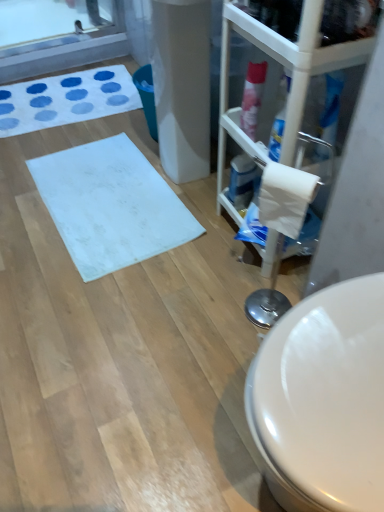
In order to face pink glossy spray can at upper right, the first cleaning product when ordered from front to back, should I rotate leftwards or rightwards?

A 8.111 degree turn to the right will do.

Image resolution: width=384 pixels, height=512 pixels. What do you see at coordinates (286, 198) in the screenshot? I see `white matte toilet paper at right` at bounding box center [286, 198].

Image resolution: width=384 pixels, height=512 pixels. I want to click on transparent plastic glass door at right, so click(x=282, y=64).

Find the location of `white fabric bath mat at upper left, which is the 1th bath mat from back to front`. white fabric bath mat at upper left, which is the 1th bath mat from back to front is located at coordinates (66, 99).

Between white matte bath mat at center, the second bath mat from the back, and transparent plastic glass door at right, which one has smaller width?

transparent plastic glass door at right.

Which of these two, white matte bath mat at center, which is counted as the second bath mat, starting from the top, or transparent plastic glass door at right, stands shorter?

With less height is white matte bath mat at center, which is counted as the second bath mat, starting from the top.

From a real-world perspective, count 2nd bath mats downward from the transparent plastic glass door at right and point to it. Please provide its 2D coordinates.

[(111, 205)]

Can you tell me how much white matte bath mat at center, which is counted as the second bath mat, starting from the top, and transparent plastic glass door at right differ in facing direction?

3.26 degrees.

Would you consider white matte toilet paper at right to be distant from transparent plastic glass door at right?

Actually, white matte toilet paper at right and transparent plastic glass door at right are a little close together.

Which of these two, white matte toilet paper at right or transparent plastic glass door at right, stands shorter?

Standing shorter between the two is white matte toilet paper at right.

Can you confirm if white matte toilet paper at right is thinner than transparent plastic glass door at right?

Yes.

Is white matte toilet paper at right a part of blue glossy spray can at center-right, marked as the second cleaning product in a front-to-back arrangement?

No, white matte toilet paper at right is not surrounded by blue glossy spray can at center-right, marked as the second cleaning product in a front-to-back arrangement.

From the image's perspective, would you say blue glossy spray can at center-right, which is the 2th cleaning product in top-to-bottom order, is positioned over white matte toilet paper at right?

Yes, from the image's perspective, blue glossy spray can at center-right, which is the 2th cleaning product in top-to-bottom order, is above white matte toilet paper at right.

Can you tell me how much blue glossy spray can at center-right, the 1th cleaning product positioned from the bottom, and white matte toilet paper at right differ in facing direction?

The facing directions of blue glossy spray can at center-right, the 1th cleaning product positioned from the bottom, and white matte toilet paper at right are 24 degrees apart.

Which of these two, blue glossy spray can at center-right, the 1th cleaning product positioned from the bottom, or white matte toilet paper at right, is wider?

With larger width is white matte toilet paper at right.

Considering the relative sizes of white matte toilet paper at right and blue glossy spray can at center-right, the 1th cleaning product from the back, in the image provided, is white matte toilet paper at right taller than blue glossy spray can at center-right, the 1th cleaning product from the back,?

Yes.

Is white matte toilet paper at right turned away from blue glossy spray can at center-right, which is the 2th cleaning product in top-to-bottom order?

No, white matte toilet paper at right is not facing the opposite direction of blue glossy spray can at center-right, which is the 2th cleaning product in top-to-bottom order.

Is white matte toilet paper at right beside blue glossy spray can at center-right, the 1th cleaning product positioned from the bottom?

There is a gap between white matte toilet paper at right and blue glossy spray can at center-right, the 1th cleaning product positioned from the bottom.

Considering the points (306, 186) and (237, 202), which point is in front, point (306, 186) or point (237, 202)?

Point (306, 186)

Which is in front, transparent plastic glass door at right or white fabric bath mat at upper left, the first bath mat from the top?

transparent plastic glass door at right is more forward.

Does transparent plastic glass door at right appear on the left side of white fabric bath mat at upper left, which is the 2th bath mat in front-to-back order?

No.

Considering the sizes of objects transparent plastic glass door at right and white fabric bath mat at upper left, which is the 2th bath mat in front-to-back order, in the image provided, who is bigger, transparent plastic glass door at right or white fabric bath mat at upper left, which is the 2th bath mat in front-to-back order,?

transparent plastic glass door at right.

Locate an element on the screen. This screenshot has width=384, height=512. glass door in front of the white fabric bath mat at upper left, the first bath mat from the top is located at coordinates (282, 64).

In the scene shown: How distant is white fabric bath mat at upper left, the first bath mat from the top, from pink glossy spray can at upper right, positioned as the second cleaning product in back-to-front order?

white fabric bath mat at upper left, the first bath mat from the top, is 1.11 meters from pink glossy spray can at upper right, positioned as the second cleaning product in back-to-front order.

Which object is closer to the camera taking this photo, white fabric bath mat at upper left, which is the 1th bath mat from back to front, or pink glossy spray can at upper right, the 1th cleaning product from the top?

pink glossy spray can at upper right, the 1th cleaning product from the top, is in front.

Based on the photo, which point is more distant from viewer, (97, 114) or (253, 93)?

Positioned behind is point (97, 114).

In the scene shown: From the image's perspective, which is above, white fabric bath mat at upper left, the first bath mat from the top, or pink glossy spray can at upper right, the second cleaning product positioned from the bottom?

white fabric bath mat at upper left, the first bath mat from the top.

Between pink glossy spray can at upper right, the second cleaning product positioned from the bottom, and blue glossy spray can at center-right, marked as the second cleaning product in a front-to-back arrangement, which one has more height?

pink glossy spray can at upper right, the second cleaning product positioned from the bottom.

From the picture: Considering the sizes of objects pink glossy spray can at upper right, positioned as the second cleaning product in back-to-front order, and blue glossy spray can at center-right, the 1th cleaning product from the back, in the image provided, who is smaller, pink glossy spray can at upper right, positioned as the second cleaning product in back-to-front order, or blue glossy spray can at center-right, the 1th cleaning product from the back,?

With smaller size is blue glossy spray can at center-right, the 1th cleaning product from the back.

Is point (259, 82) closer or farther from the camera than point (249, 186)?

Clearly, point (259, 82) is closer to the camera than point (249, 186).

Image resolution: width=384 pixels, height=512 pixels. I want to click on glass door on the right of white matte bath mat at center, which is counted as the second bath mat, starting from the top, so click(x=282, y=64).

The width and height of the screenshot is (384, 512). What are the coordinates of `toilet paper that is on the left side of transparent plastic glass door at right` in the screenshot? It's located at (286, 198).

Based on their spatial positions, is white matte toilet paper at right or transparent plastic glass door at right further from blue glossy spray can at center-right, the 1th cleaning product positioned from the bottom?

white matte toilet paper at right lies further to blue glossy spray can at center-right, the 1th cleaning product positioned from the bottom, than the other object.

Based on their spatial positions, is white matte bath mat at center, which is counted as the first bath mat, starting from the bottom, or white matte toilet paper at right closer to pink glossy spray can at upper right, the second cleaning product positioned from the bottom?

The object closer to pink glossy spray can at upper right, the second cleaning product positioned from the bottom, is white matte toilet paper at right.

Which object lies nearer to the anchor point white matte toilet paper at right, white fabric bath mat at upper left, the first bath mat from the top, or white matte bath mat at center, which is the 1th bath mat in front-to-back order?

Among the two, white matte bath mat at center, which is the 1th bath mat in front-to-back order, is located nearer to white matte toilet paper at right.

When comparing their distances from white matte bath mat at center, which is counted as the first bath mat, starting from the bottom, does white fabric bath mat at upper left, the first bath mat from the top, or white matte toilet paper at right seem closer?

Among the two, white fabric bath mat at upper left, the first bath mat from the top, is located nearer to white matte bath mat at center, which is counted as the first bath mat, starting from the bottom.

From the image, which object appears to be farther from pink glossy spray can at upper right, positioned as the second cleaning product in back-to-front order, white fabric bath mat at upper left, which is the 2th bath mat in front-to-back order, or blue glossy spray can at center-right, the 1th cleaning product positioned from the bottom?

white fabric bath mat at upper left, which is the 2th bath mat in front-to-back order, is positioned further to the anchor pink glossy spray can at upper right, positioned as the second cleaning product in back-to-front order.

Considering their positions, is pink glossy spray can at upper right, positioned as the second cleaning product in back-to-front order, positioned further to white matte bath mat at center, the second bath mat from the back, than transparent plastic glass door at right?

transparent plastic glass door at right is positioned further to the anchor white matte bath mat at center, the second bath mat from the back.

From the image, which object appears to be farther from white fabric bath mat at upper left, which is the 1th bath mat from back to front, blue glossy spray can at center-right, the 1th cleaning product positioned from the bottom, or white matte bath mat at center, which is the 1th bath mat in front-to-back order?

blue glossy spray can at center-right, the 1th cleaning product positioned from the bottom, is further to white fabric bath mat at upper left, which is the 1th bath mat from back to front.

Estimate the real-world distances between objects in this image. Which object is closer to transparent plastic glass door at right, white matte toilet paper at right or white matte bath mat at center, which is counted as the first bath mat, starting from the bottom?

white matte toilet paper at right lies closer to transparent plastic glass door at right than the other object.

Where is `bath mat located between white fabric bath mat at upper left, which is the 1th bath mat from back to front, and blue glossy spray can at center-right, the 1th cleaning product from the back, in the left-right direction`? bath mat located between white fabric bath mat at upper left, which is the 1th bath mat from back to front, and blue glossy spray can at center-right, the 1th cleaning product from the back, in the left-right direction is located at coordinates (111, 205).

This screenshot has width=384, height=512. I want to click on toilet paper between transparent plastic glass door at right and pink glossy spray can at upper right, positioned as the second cleaning product in back-to-front order, from front to back, so click(x=286, y=198).

This screenshot has height=512, width=384. In order to click on bath mat between white matte toilet paper at right and white fabric bath mat at upper left, which is the 2th bath mat in front-to-back order, from front to back in this screenshot , I will do `click(111, 205)`.

Find the location of a particular element. This screenshot has width=384, height=512. toilet paper between transparent plastic glass door at right and blue glossy spray can at center-right, which is the 2th cleaning product in top-to-bottom order, from front to back is located at coordinates (286, 198).